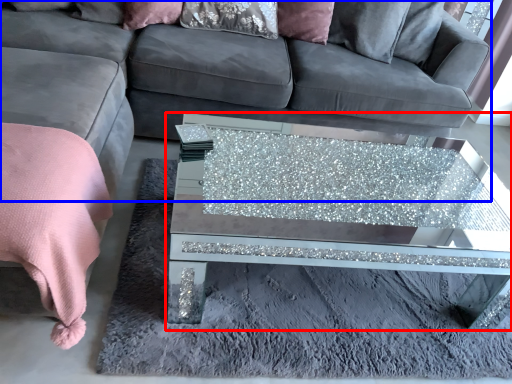
Question: Among these objects, which one is nearest to the camera, coffee table (highlighted by a red box) or studio couch (highlighted by a blue box)?

Choices:
 (A) coffee table
 (B) studio couch

Answer: (A)